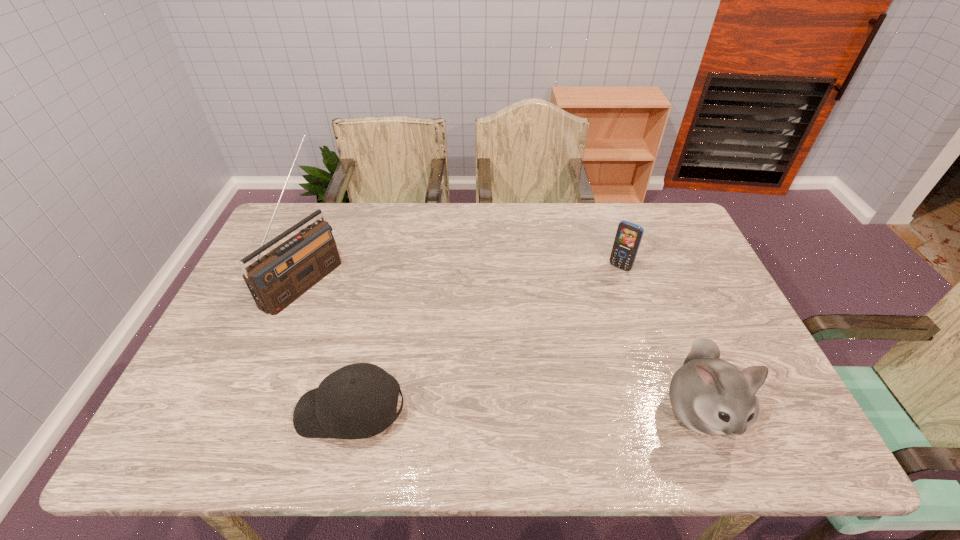
The width and height of the screenshot is (960, 540). I want to click on vacant region that satisfies the following two spatial constraints: 1. on the front side of the shortest object; 2. with a logo on the front of the tallest object, so click(x=251, y=411).